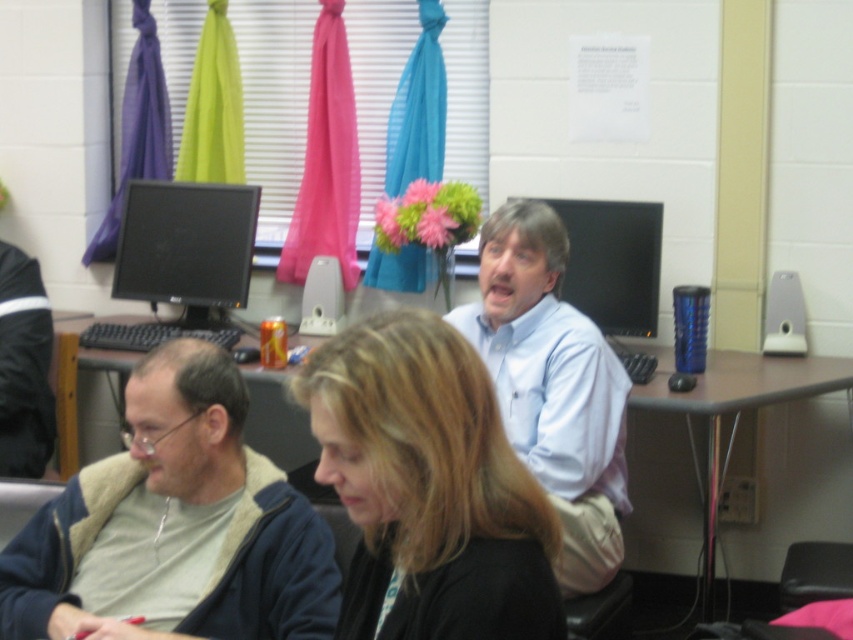
Where is `black matte hair at center`? This screenshot has width=853, height=640. black matte hair at center is located at coordinates pos(428,486).

This screenshot has height=640, width=853. Identify the location of black matte hair at center. (428, 486).

Does point (160, 531) come in front of point (403, 480)?

No, it is not.

Does blue fleece jacket at lower left come in front of black matte hair at center?

That is False.

You are a GUI agent. You are given a task and a screenshot of the screen. Output one action in this format:
    pyautogui.click(x=<x>, y=<y>)
    Task: Click on the blue fleece jacket at lower left
    This screenshot has width=853, height=640.
    Given the screenshot: What is the action you would take?
    pyautogui.click(x=175, y=525)

Does light blue shirt at center have a lesser width compared to matte black monitor at center?

No, light blue shirt at center is not thinner than matte black monitor at center.

What do you see at coordinates (552, 385) in the screenshot? This screenshot has height=640, width=853. I see `light blue shirt at center` at bounding box center [552, 385].

Does point (537, 308) come in front of point (566, 282)?

That is True.

At what (x,y) coordinates should I click in order to perform the action: click on light blue shirt at center. Please return your answer as a coordinate pair (x, y). Looking at the image, I should click on (552, 385).